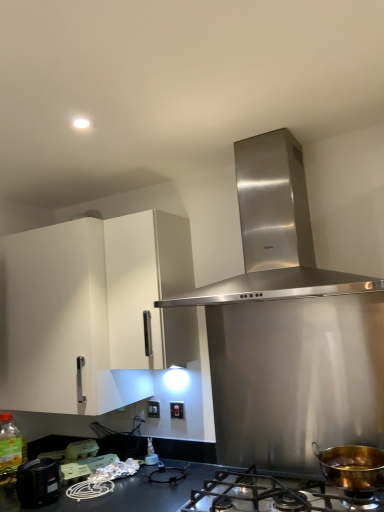
Question: From a real-world perspective, is translucent plastic bottle at lower left, the first bottle when ordered from left to right, positioned under matte black switch at center, the 2th electric outlet viewed from the back, based on gravity?

Choices:
 (A) no
 (B) yes

Answer: (B)

Question: Is translucent plastic bottle at lower left, the first bottle when ordered from left to right, at the left side of matte black switch at center, the 2th electric outlet viewed from the back?

Choices:
 (A) yes
 (B) no

Answer: (A)

Question: Considering the relative sizes of translucent plastic bottle at lower left, placed as the 2th bottle when sorted from right to left, and matte black switch at center, the 2th electric outlet from the left, in the image provided, is translucent plastic bottle at lower left, placed as the 2th bottle when sorted from right to left, wider than matte black switch at center, the 2th electric outlet from the left,?

Choices:
 (A) yes
 (B) no

Answer: (A)

Question: Is matte black switch at center, which is counted as the 1th electric outlet, starting from the front, a part of translucent plastic bottle at lower left, the first bottle when ordered from left to right?

Choices:
 (A) yes
 (B) no

Answer: (B)

Question: From the image's perspective, is translucent plastic bottle at lower left, placed as the 2th bottle when sorted from right to left, under matte black switch at center, the 2th electric outlet viewed from the back?

Choices:
 (A) yes
 (B) no

Answer: (A)

Question: Does point (152, 415) appear closer or farther from the camera than point (92, 461)?

Choices:
 (A) closer
 (B) farther

Answer: (B)

Question: Looking at their shapes, would you say white plastic electric outlet at center, which appears as the 2th electric outlet when viewed from the right, is wider or thinner than matte plastic container at lower left, acting as the second appliance starting from the front?

Choices:
 (A) thin
 (B) wide

Answer: (A)

Question: Is white plastic electric outlet at center, marked as the 1th electric outlet in a back-to-front arrangement, to the left or to the right of matte plastic container at lower left, acting as the second appliance starting from the front, in the image?

Choices:
 (A) left
 (B) right

Answer: (B)

Question: Considering the positions of white plastic electric outlet at center, which appears as the 2th electric outlet when viewed from the right, and matte plastic container at lower left, which is the second appliance from back to front, in the image, is white plastic electric outlet at center, which appears as the 2th electric outlet when viewed from the right, bigger or smaller than matte plastic container at lower left, which is the second appliance from back to front,?

Choices:
 (A) small
 (B) big

Answer: (A)

Question: Is white plastic electric outlet at center, the first electric outlet from the left, spatially inside translucent plastic bottle at center, the second bottle viewed from the left, or outside of it?

Choices:
 (A) inside
 (B) outside

Answer: (B)

Question: Is point (147, 404) positioned closer to the camera than point (150, 450)?

Choices:
 (A) farther
 (B) closer

Answer: (A)

Question: From a real-world perspective, is white plastic electric outlet at center, the first electric outlet from the left, above or below translucent plastic bottle at center, which appears as the 1th bottle when viewed from the right?

Choices:
 (A) below
 (B) above

Answer: (B)

Question: Considering the positions of white plastic electric outlet at center, acting as the 2th electric outlet starting from the front, and translucent plastic bottle at center, the second bottle viewed from the left, in the image, is white plastic electric outlet at center, acting as the 2th electric outlet starting from the front, bigger or smaller than translucent plastic bottle at center, the second bottle viewed from the left,?

Choices:
 (A) big
 (B) small

Answer: (B)

Question: Would you say matte black switch at center, which is counted as the 1th electric outlet, starting from the front, is to the left or to the right of white matte cabinet at upper left in the picture?

Choices:
 (A) right
 (B) left

Answer: (A)

Question: Considering the positions of matte black switch at center, the 2th electric outlet viewed from the back, and white matte cabinet at upper left in the image, is matte black switch at center, the 2th electric outlet viewed from the back, wider or thinner than white matte cabinet at upper left?

Choices:
 (A) thin
 (B) wide

Answer: (A)